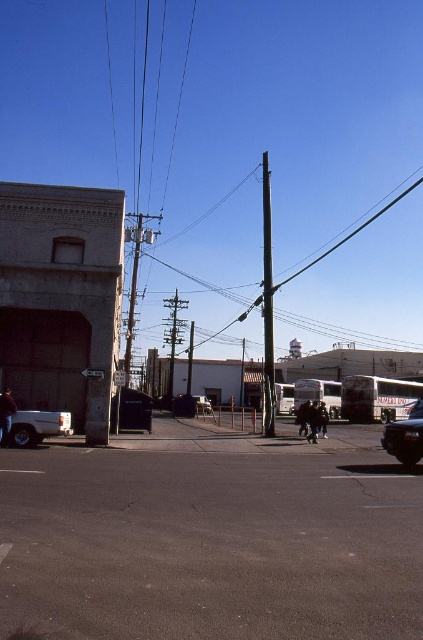
Question: Is metallic gray telegraph pole at center bigger than metallic silver car at center?

Choices:
 (A) yes
 (B) no

Answer: (A)

Question: Is shiny black sedan at lower right smaller than metallic gray telegraph pole at center?

Choices:
 (A) yes
 (B) no

Answer: (A)

Question: Does dark asphalt parking lot at lower left appear under shiny black sedan at lower right?

Choices:
 (A) yes
 (B) no

Answer: (A)

Question: Which point appears farthest from the camera in this image?

Choices:
 (A) (422, 451)
 (B) (268, 404)
 (C) (195, 516)
 (D) (198, 400)

Answer: (D)

Question: Estimate the real-world distances between objects in this image. Which object is farther from the metallic gray telegraph pole at center?

Choices:
 (A) dark asphalt parking lot at lower left
 (B) shiny black sedan at lower right

Answer: (B)

Question: Which point appears farthest from the camera in this image?

Choices:
 (A) (203, 400)
 (B) (412, 435)
 (C) (173, 561)
 (D) (175, 317)

Answer: (D)